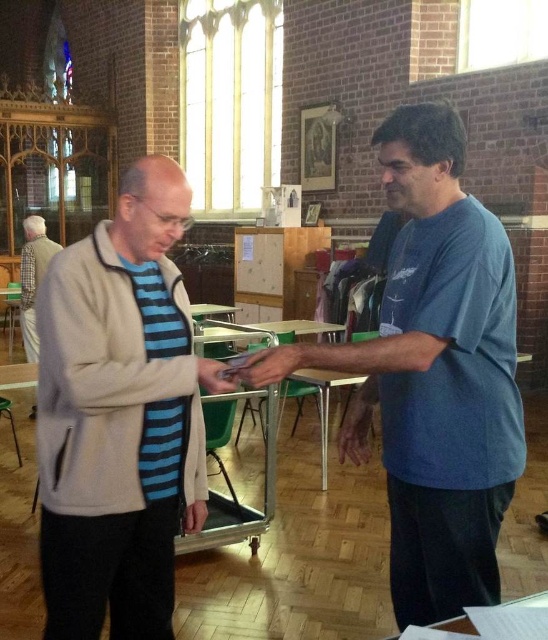
You are standing in the church and see a point at coordinates (x=118, y=417). Which object is this point located on?

The point at coordinates (x=118, y=417) is located on the light beige fleece jacket at center.

You are an observer in the church. You notice two objects in the scene, the blue cotton shirt at right and the matte black hand at center. Which object is located more to the right side?

The blue cotton shirt at right is positioned on the right side of matte black hand at center, so the blue cotton shirt at right is more to the right side.